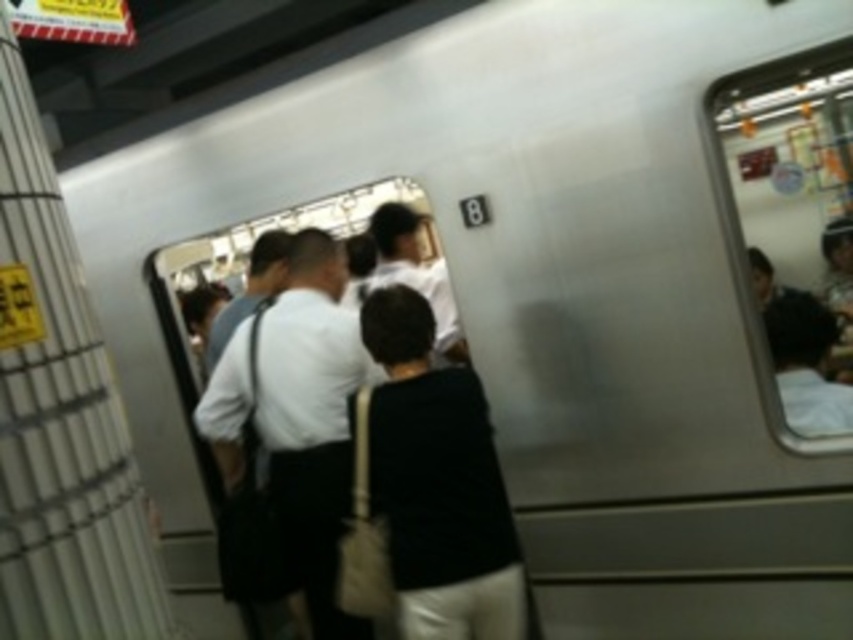
Question: Is black fabric bag at center smaller than white matte shirt at center?

Choices:
 (A) yes
 (B) no

Answer: (A)

Question: Is black fabric bag at center to the left of white matte shirt at center from the viewer's perspective?

Choices:
 (A) yes
 (B) no

Answer: (B)

Question: Is black fabric bag at center positioned at the back of white matte shirt at center?

Choices:
 (A) yes
 (B) no

Answer: (B)